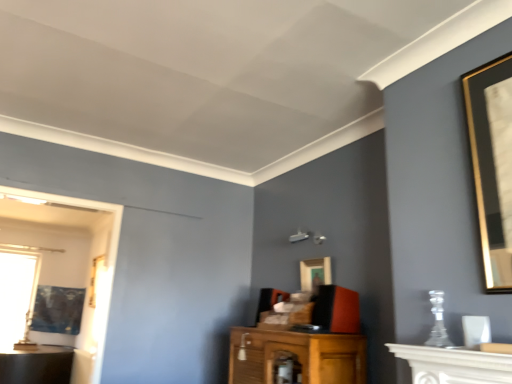
Measure the distance between transparent glass window at left and camera.

5.42 meters.

The width and height of the screenshot is (512, 384). Describe the element at coordinates (16, 295) in the screenshot. I see `transparent glass window at left` at that location.

Locate an element on the screen. gold-framed picture at left, which appears as the 2th picture frame when ordered from the bottom is located at coordinates (95, 279).

How much space does gold-framed picture at center, the 3th picture frame in the back-to-front sequence, occupy vertically?

The height of gold-framed picture at center, the 3th picture frame in the back-to-front sequence, is 12.78 inches.

Find the location of a particular element. The image size is (512, 384). matte black picture frame at left, arranged as the 3th picture frame when viewed from the right is located at coordinates (58, 309).

Does point (63, 293) appear closer or farther from the camera than point (18, 288)?

Point (63, 293) appears to be farther away from the viewer than point (18, 288).

From the image's perspective, is matte black picture frame at left, arranged as the 3th picture frame when viewed from the right, on transparent glass window at left?

Yes, from the image's perspective, matte black picture frame at left, arranged as the 3th picture frame when viewed from the right, is on top of transparent glass window at left.

Which picture frame is the 1st one when counting from the right side of the transparent glass window at left? Please provide its 2D coordinates.

[(58, 309)]

From the picture: Considering the sizes of matte black picture frame at left, arranged as the 3th picture frame when viewed from the top, and transparent glass window at left in the image, is matte black picture frame at left, arranged as the 3th picture frame when viewed from the top, taller or shorter than transparent glass window at left?

In the image, matte black picture frame at left, arranged as the 3th picture frame when viewed from the top, appears to be shorter than transparent glass window at left.

I want to click on vanity located above the transparent glass window at left (from a real-world perspective), so click(454, 365).

In terms of height, does white marble fireplace at lower right look taller or shorter compared to transparent glass window at left?

In the image, white marble fireplace at lower right appears to be shorter than transparent glass window at left.

Is white marble fireplace at lower right spatially inside transparent glass window at left, or outside of it?

white marble fireplace at lower right is not inside transparent glass window at left, it's outside.

Is white marble fireplace at lower right looking in the opposite direction of transparent glass window at left?

No, white marble fireplace at lower right is not facing the opposite direction of transparent glass window at left.

Based on the photo, which is farther from the camera, (309,264) or (20,270)?

Point (20,270)

Which object is thinner, gold-framed picture at center, the 3th picture frame in the back-to-front sequence, or transparent glass window at left?

gold-framed picture at center, the 3th picture frame in the back-to-front sequence, is thinner.

Are gold-framed picture at center, the 3th picture frame in the bottom-to-top sequence, and transparent glass window at left far apart?

Indeed, gold-framed picture at center, the 3th picture frame in the bottom-to-top sequence, is not near transparent glass window at left.

Which is nearer, [307,283] or [504,355]?

Point [307,283].

Is gold-framed picture at center, positioned as the 3th picture frame in left-to-right order, positioned before white marble fireplace at lower right?

No, gold-framed picture at center, positioned as the 3th picture frame in left-to-right order, is behind white marble fireplace at lower right.

Who is smaller, gold-framed picture at center, the 3th picture frame in the bottom-to-top sequence, or white marble fireplace at lower right?

gold-framed picture at center, the 3th picture frame in the bottom-to-top sequence.

Is gold-framed picture at center, positioned as the 3th picture frame in left-to-right order, aimed at white marble fireplace at lower right?

No, gold-framed picture at center, positioned as the 3th picture frame in left-to-right order, is not oriented towards white marble fireplace at lower right.

Between gold-framed picture at left, which is the 2th picture frame from right to left, and gold-framed picture at center, the 3th picture frame in the bottom-to-top sequence, which one has smaller width?

With smaller width is gold-framed picture at center, the 3th picture frame in the bottom-to-top sequence.

From a real-world perspective, is gold-framed picture at left, which is the 2th picture frame from right to left, below gold-framed picture at center, the 1th picture frame in the right-to-left sequence?

No.

Considering the relative positions of gold-framed picture at left, which is the 2th picture frame from right to left, and gold-framed picture at center, which ranks as the 1th picture frame in front-to-back order, in the image provided, is gold-framed picture at left, which is the 2th picture frame from right to left, to the right of gold-framed picture at center, which ranks as the 1th picture frame in front-to-back order, from the viewer's perspective?

Incorrect, gold-framed picture at left, which is the 2th picture frame from right to left, is not on the right side of gold-framed picture at center, which ranks as the 1th picture frame in front-to-back order.

Is the surface of gold-framed picture at left, which appears as the second picture frame when viewed from the front, in direct contact with gold-framed picture at center, the 3th picture frame in the bottom-to-top sequence?

gold-framed picture at left, which appears as the second picture frame when viewed from the front, and gold-framed picture at center, the 3th picture frame in the bottom-to-top sequence, are not in contact.

From the image's perspective, is white marble fireplace at lower right on top of matte black picture frame at left, which is counted as the first picture frame, starting from the bottom?

Yes, from the image's perspective, white marble fireplace at lower right is on top of matte black picture frame at left, which is counted as the first picture frame, starting from the bottom.

Is point (484, 368) closer or farther from the camera than point (61, 288)?

Point (484, 368) is positioned closer to the camera compared to point (61, 288).

Can we say white marble fireplace at lower right lies outside matte black picture frame at left, arranged as the 3th picture frame when viewed from the right?

Indeed, white marble fireplace at lower right is completely outside matte black picture frame at left, arranged as the 3th picture frame when viewed from the right.

Would you say transparent glass window at left is inside or outside white marble fireplace at lower right?

transparent glass window at left is located beyond the bounds of white marble fireplace at lower right.

Considering the sizes of transparent glass window at left and white marble fireplace at lower right in the image, is transparent glass window at left wider or thinner than white marble fireplace at lower right?

transparent glass window at left is thinner than white marble fireplace at lower right.

Is transparent glass window at left not near white marble fireplace at lower right?

That's right, there is a large distance between transparent glass window at left and white marble fireplace at lower right.

Relative to white marble fireplace at lower right, is transparent glass window at left in front or behind?

In the image, transparent glass window at left appears behind white marble fireplace at lower right.

Where is `window below the matte black picture frame at left, which is counted as the first picture frame, starting from the bottom (from the image's perspective)`? window below the matte black picture frame at left, which is counted as the first picture frame, starting from the bottom (from the image's perspective) is located at coordinates (16, 295).

Where is `vanity located on the right of transparent glass window at left`? The width and height of the screenshot is (512, 384). vanity located on the right of transparent glass window at left is located at coordinates (454, 365).

Consider the image. Considering their positions, is transparent glass window at left positioned closer to white marble fireplace at lower right than gold-framed picture at left, which appears as the second picture frame when viewed from the front?

gold-framed picture at left, which appears as the second picture frame when viewed from the front.

Estimate the real-world distances between objects in this image. Which object is further from white marble fireplace at lower right, gold-framed picture at center, arranged as the 1th picture frame when viewed from the top, or transparent glass window at left?

transparent glass window at left.

Looking at the image, which one is located closer to gold-framed picture at left, which ranks as the second picture frame in back-to-front order, transparent glass window at left or white marble fireplace at lower right?

Among the two, white marble fireplace at lower right is located nearer to gold-framed picture at left, which ranks as the second picture frame in back-to-front order.

Estimate the real-world distances between objects in this image. Which object is closer to matte black picture frame at left, the third picture frame viewed from the front, transparent glass window at left or gold-framed picture at left, which ranks as the second picture frame in back-to-front order?

transparent glass window at left is closer to matte black picture frame at left, the third picture frame viewed from the front.

Which object lies further to the anchor point gold-framed picture at center, arranged as the 1th picture frame when viewed from the top, matte black picture frame at left, the third picture frame viewed from the front, or white marble fireplace at lower right?

matte black picture frame at left, the third picture frame viewed from the front, lies further to gold-framed picture at center, arranged as the 1th picture frame when viewed from the top, than the other object.

When comparing their distances from matte black picture frame at left, the third picture frame viewed from the front, does gold-framed picture at left, the second picture frame positioned from the left, or gold-framed picture at center, positioned as the 3th picture frame in left-to-right order, seem closer?

Among the two, gold-framed picture at left, the second picture frame positioned from the left, is located nearer to matte black picture frame at left, the third picture frame viewed from the front.

Based on the photo, when comparing their distances from gold-framed picture at left, which is the 2th picture frame from right to left, does matte black picture frame at left, the third picture frame viewed from the front, or gold-framed picture at center, positioned as the 3th picture frame in left-to-right order, seem closer?

gold-framed picture at center, positioned as the 3th picture frame in left-to-right order, is positioned closer to the anchor gold-framed picture at left, which is the 2th picture frame from right to left.

In the scene shown: Which object lies further to the anchor point gold-framed picture at center, the 1th picture frame in the right-to-left sequence, gold-framed picture at left, the second picture frame positioned from the left, or white marble fireplace at lower right?

gold-framed picture at left, the second picture frame positioned from the left, is further to gold-framed picture at center, the 1th picture frame in the right-to-left sequence.

Identify the location of picture frame located between transparent glass window at left and gold-framed picture at left, which ranks as the second picture frame in back-to-front order, in the left-right direction. The width and height of the screenshot is (512, 384). (58, 309).

Where is `picture frame located between matte black picture frame at left, marked as the 1th picture frame in a back-to-front arrangement, and gold-framed picture at center, the 3th picture frame in the bottom-to-top sequence, in the left-right direction`? This screenshot has width=512, height=384. picture frame located between matte black picture frame at left, marked as the 1th picture frame in a back-to-front arrangement, and gold-framed picture at center, the 3th picture frame in the bottom-to-top sequence, in the left-right direction is located at coordinates (95, 279).

In order to click on picture frame between white marble fireplace at lower right and gold-framed picture at left, which is the 2th picture frame from right to left, in the front-back direction in this screenshot , I will do `click(315, 273)`.